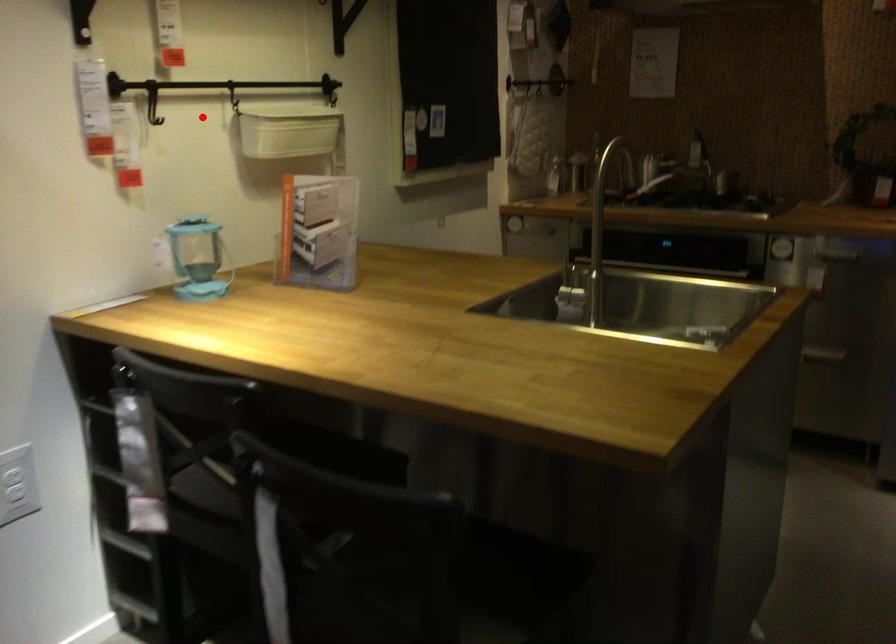
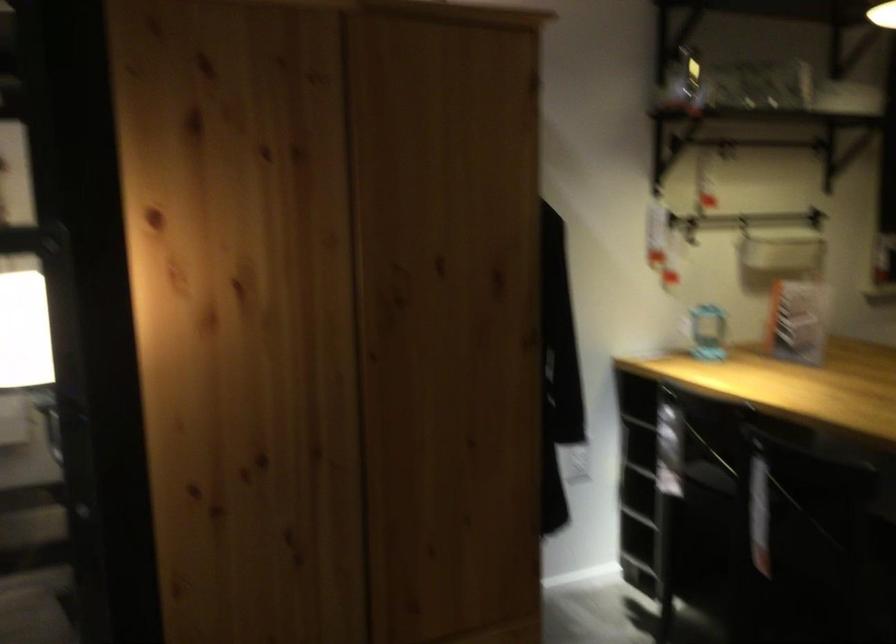
Question: I am providing you with two images of the same scene from different viewpoints. A red point is shown in image1. For the corresponding object point in image2, is it positioned nearer or farther from the camera?

Choices:
 (A) Nearer
 (B) Farther

Answer: (B)